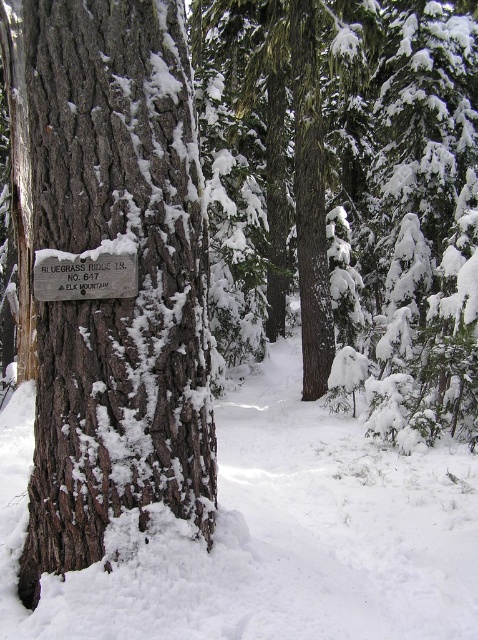
Can you confirm if dark brown textured bark at center is positioned below white fluffy snow at lower center?

No.

Is point (77, 97) positioned after point (272, 516)?

No, it is in front of (272, 516).

The height and width of the screenshot is (640, 478). Identify the location of dark brown textured bark at center. (117, 298).

Locate an element on the screen. white fluffy snow at lower center is located at coordinates (273, 536).

Locate an element on the screen. white fluffy snow at lower center is located at coordinates (273, 536).

The image size is (478, 640). What do you see at coordinates (117, 298) in the screenshot?
I see `dark brown textured bark at center` at bounding box center [117, 298].

Based on the photo, does dark brown textured bark at center appear on the left side of silver metallic sign at left?

In fact, dark brown textured bark at center is to the right of silver metallic sign at left.

Is point (98, 358) positioned before point (36, 275)?

Yes.

I want to click on dark brown textured bark at center, so click(x=117, y=298).